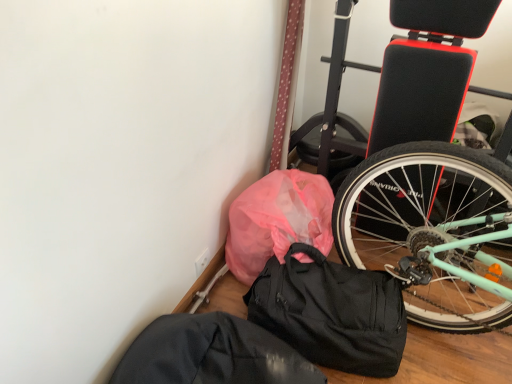
Question: Relative to black fabric sack at lower center, is pink plastic bag at lower left in front or behind?

Choices:
 (A) behind
 (B) front

Answer: (A)

Question: Is pink plastic bag at lower left inside or outside of black fabric sack at lower center?

Choices:
 (A) inside
 (B) outside

Answer: (B)

Question: Estimate the real-world distances between objects in this image. Which object is farther from the pink plastic bag at lower left?

Choices:
 (A) black fabric sack at lower center
 (B) black matte duffel bag at lower center

Answer: (A)

Question: Which object is positioned closest to the black matte duffel bag at lower center?

Choices:
 (A) pink plastic bag at lower left
 (B) black fabric sack at lower center

Answer: (A)